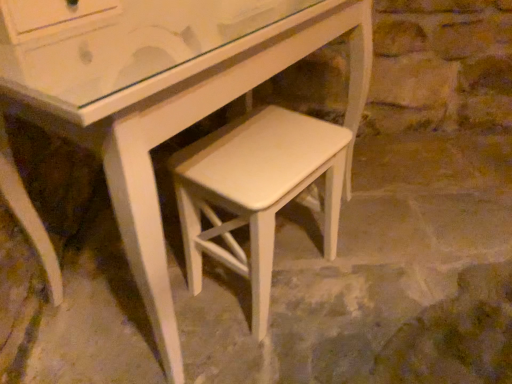
Question: Based on their positions, is white matte stool at center located to the left or right of white painted wood stool at center?

Choices:
 (A) left
 (B) right

Answer: (A)

Question: From their relative heights in the image, would you say white matte stool at center is taller or shorter than white painted wood stool at center?

Choices:
 (A) short
 (B) tall

Answer: (B)

Question: Is white matte stool at center wider or thinner than white painted wood stool at center?

Choices:
 (A) thin
 (B) wide

Answer: (A)

Question: Considering the positions of white painted wood stool at center and white matte stool at center in the image, is white painted wood stool at center bigger or smaller than white matte stool at center?

Choices:
 (A) big
 (B) small

Answer: (A)

Question: From a real-world perspective, is white painted wood stool at center physically located above or below white matte stool at center?

Choices:
 (A) above
 (B) below

Answer: (B)

Question: Relative to white matte stool at center, is white painted wood stool at center in front or behind?

Choices:
 (A) front
 (B) behind

Answer: (B)

Question: Is white painted wood stool at center situated inside white matte stool at center or outside?

Choices:
 (A) inside
 (B) outside

Answer: (B)